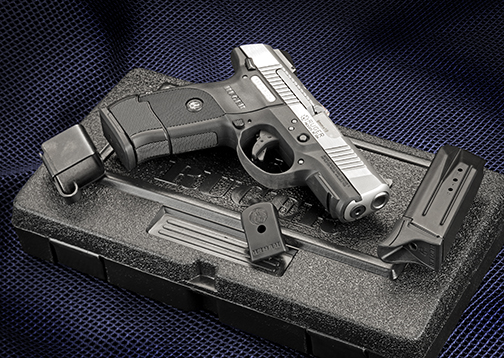
Identify the location of blue cloth. The width and height of the screenshot is (504, 358). (407, 118).